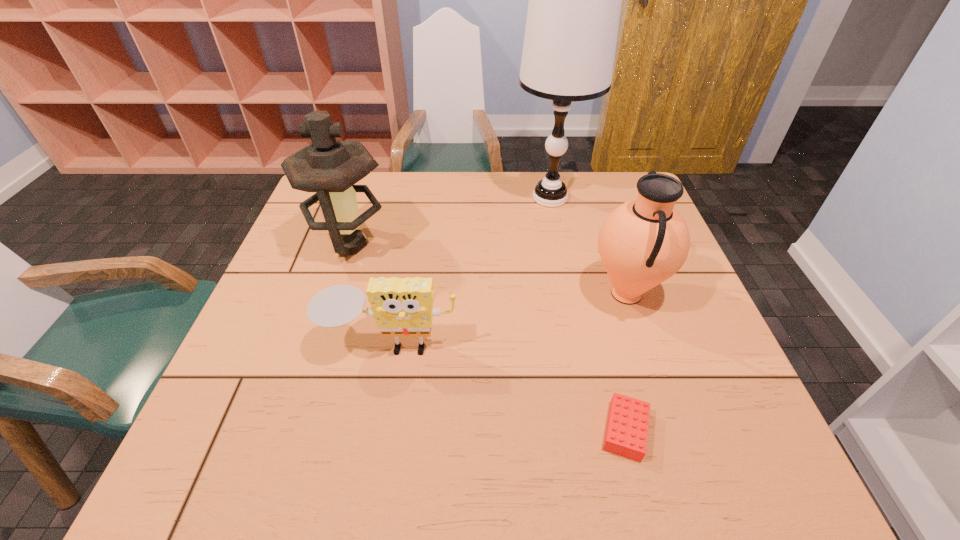
The width and height of the screenshot is (960, 540). Find the location of `vacant space situated 0.200m on the front-facing side of the sponge`. vacant space situated 0.200m on the front-facing side of the sponge is located at coordinates (370, 464).

Identify the location of vacant area situated on the right of the shortest object. The image size is (960, 540). (744, 430).

This screenshot has width=960, height=540. What are the coordinates of `object present at the far edge` in the screenshot? It's located at (574, 7).

The height and width of the screenshot is (540, 960). I want to click on object positioned at the near edge, so click(626, 433).

Locate an element on the screen. The width and height of the screenshot is (960, 540). object present at the left edge is located at coordinates (330, 167).

Locate an element on the screen. object located in the right edge section of the desktop is located at coordinates (643, 242).

The width and height of the screenshot is (960, 540). Identify the location of vacant space at the far edge of the desktop. (574, 195).

The image size is (960, 540). Find the location of `free location at the near edge of the desktop`. free location at the near edge of the desktop is located at coordinates (415, 450).

The image size is (960, 540). In the image, there is a desktop. In order to click on free space at the left edge in this screenshot , I will do `click(274, 388)`.

Find the location of a particular element. This screenshot has width=960, height=540. free space at the right edge of the desktop is located at coordinates (682, 384).